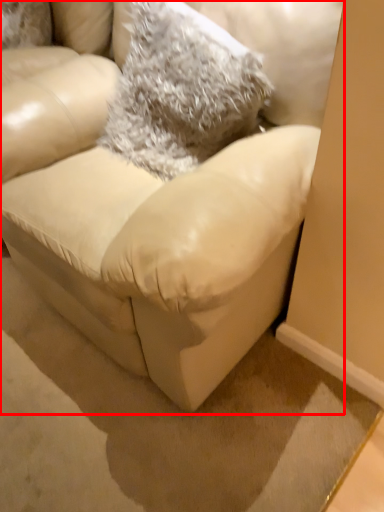
Question: From the image's perspective, what is the correct spatial relationship of studio couch (annotated by the red box) in relation to throw pillow?

Choices:
 (A) above
 (B) below

Answer: (B)